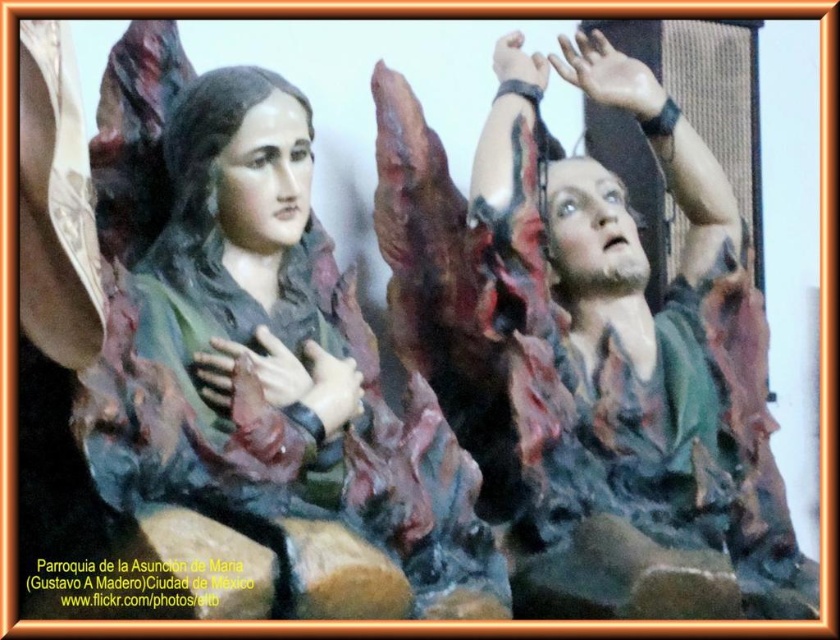
You are an art conservator examining the statues in the church. You notice the matte green statue at center and the matte brown hand at upper center. Which object is positioned higher in the image?

The matte brown hand at upper center is positioned higher than the matte green statue at center.

You are standing in a church and want to take a photo of the statues. You notice a specific point at coordinates point [255,552] that you want to focus on. Given that the camera requires a minimum focus distance of 15 feet to capture details clearly, will this point be in focus?

The distance of point [255,552] from the camera is 17.47 feet, which is greater than the minimum focus distance of 15 feet. Therefore, the point will be in focus.